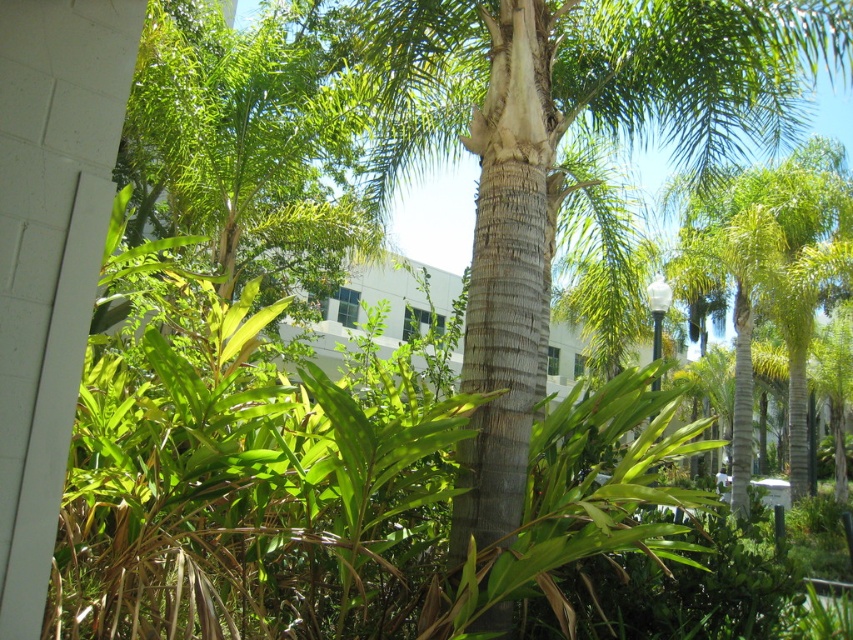
From the picture: You are designing a garden layout and need to place a small bench between the smooth brown trunk at center and the green textured palm tree at center. Since the bench requires 1.2 meters of space, can it fit between them?

The smooth brown trunk at center is smaller than the green textured palm tree at center, but the description does not provide information about the distance between them. Therefore, it is impossible to determine if the bench will fit based on the given details.

You are standing in the tropical garden and want to take a photo of the smooth brown trunk at center. Where should you position yourself to capture it in the frame?

To capture the smooth brown trunk at center in the frame, position yourself such that the trunk is centered at the coordinates approximately 0.233 on the x and 0.653 on the y axis.

You are standing in the tropical garden and notice a specific point marked at coordinates (556, 148). Based on the scene description, can you identify what this point is located on?

The point at coordinates (556, 148) is located on the smooth brown trunk at center.